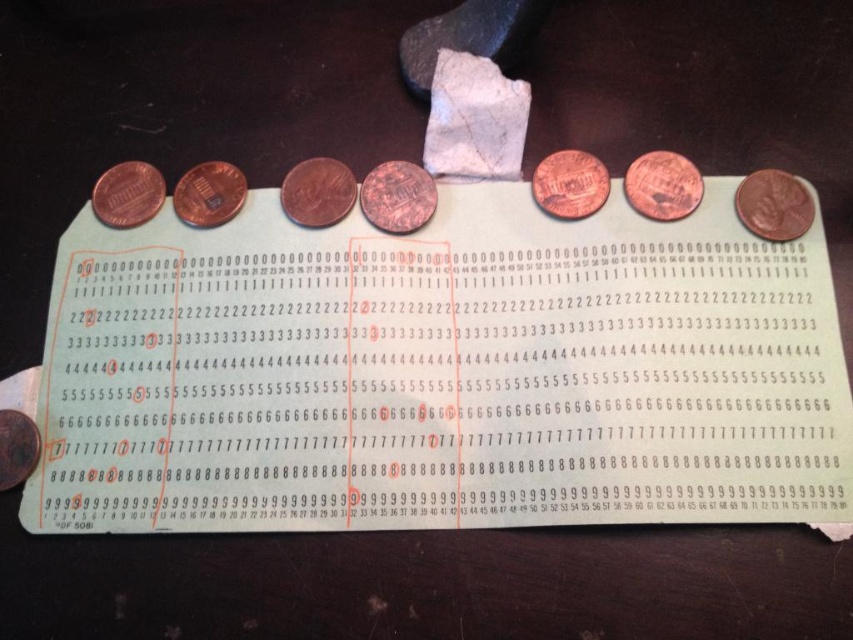
You are a data entry clerk working with a vintage punched card. You need to place a copper brass penny on the card such that it covers the column marked 15. The column 15 is located at point (662, 186). Is the copper brass penny at upper right currently covering column 15?

The copper brass penny at upper right is located at point (662, 186), so yes, it is covering column 15.